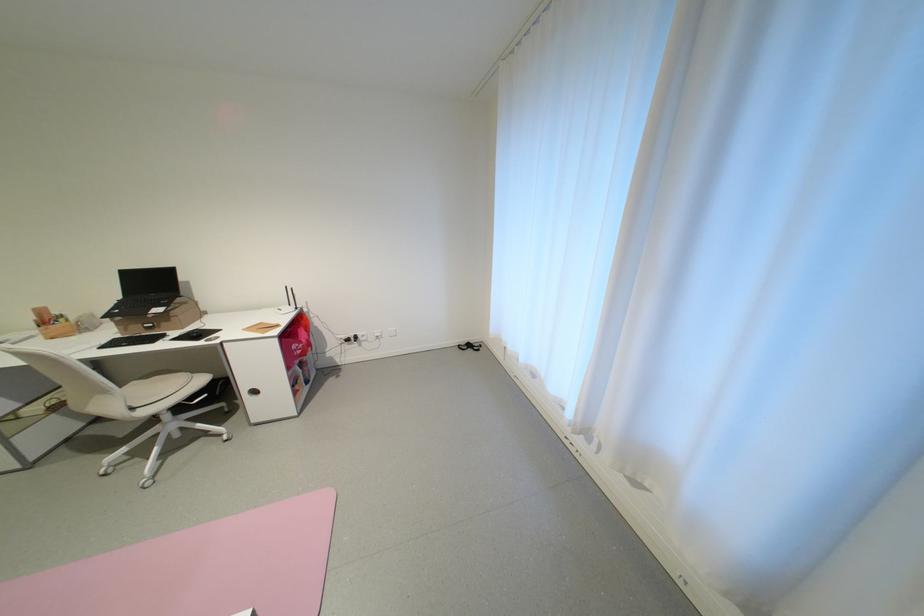
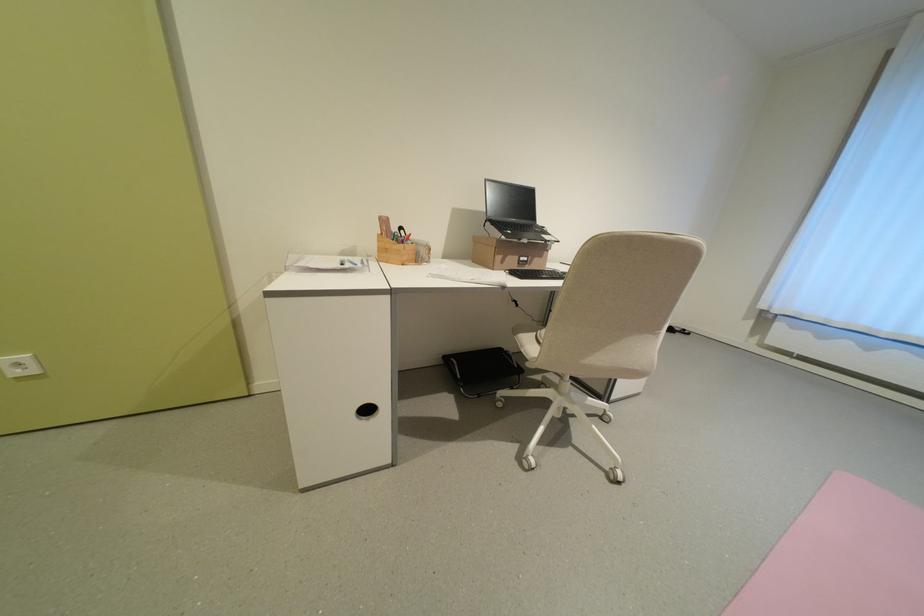
Question: I am providing you with two images of the same scene from different viewpoints. Please identify which objects are invisible in image2.

Choices:
 (A) chair sitting surface
 (B) cardboard box
 (C) round cabinet handle
 (D) none of these

Answer: (D)